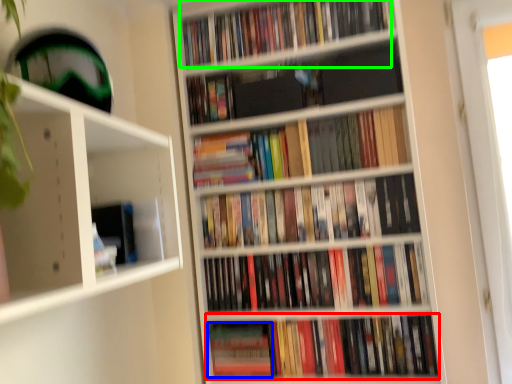
Question: Considering the real-world distances, which object is closest to book (highlighted by a red box)? paperback book (highlighted by a blue box) or book (highlighted by a green box).

Choices:
 (A) paperback book
 (B) book

Answer: (A)